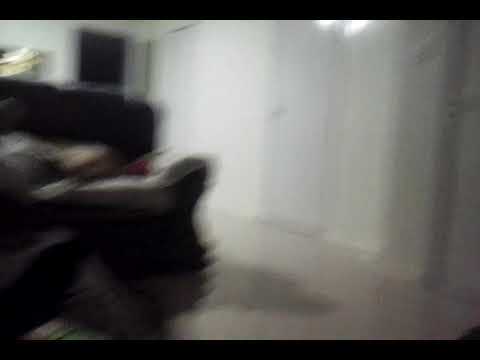
Identify the location of window. (97, 61).